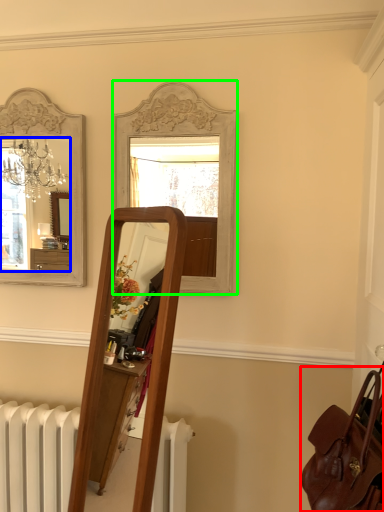
Question: Which is nearer to the bag (highlighted by a red box)? mirror (highlighted by a blue box) or mirror (highlighted by a green box).

Choices:
 (A) mirror
 (B) mirror

Answer: (B)